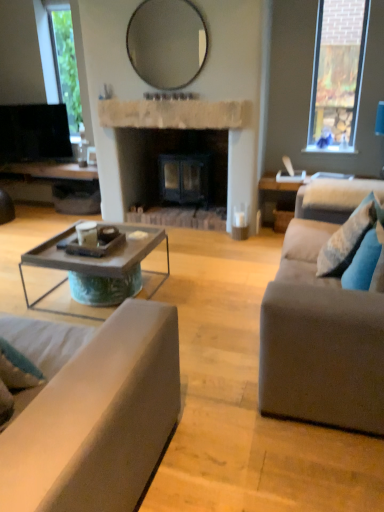
Question: Does matte glass mirror at upper center appear on the right side of blue fabric pillow at right, the 2th pillow from the back?

Choices:
 (A) no
 (B) yes

Answer: (A)

Question: Considering the relative sizes of matte glass mirror at upper center and blue fabric pillow at right, which is counted as the 1th pillow, starting from the front, in the image provided, is matte glass mirror at upper center smaller than blue fabric pillow at right, which is counted as the 1th pillow, starting from the front,?

Choices:
 (A) no
 (B) yes

Answer: (A)

Question: Is matte glass mirror at upper center wider than blue fabric pillow at right, which is counted as the 1th pillow, starting from the front?

Choices:
 (A) no
 (B) yes

Answer: (A)

Question: Does matte glass mirror at upper center have a greater height compared to blue fabric pillow at right, which is counted as the 1th pillow, starting from the front?

Choices:
 (A) yes
 (B) no

Answer: (A)

Question: Would you say matte glass mirror at upper center is outside blue fabric pillow at right, the 2th pillow from the back?

Choices:
 (A) no
 (B) yes

Answer: (B)

Question: Which is correct: matte glass mirror at upper center is inside rustic wood coffee table at center, or outside of it?

Choices:
 (A) outside
 (B) inside

Answer: (A)

Question: Looking at the image, does matte glass mirror at upper center seem bigger or smaller compared to rustic wood coffee table at center?

Choices:
 (A) big
 (B) small

Answer: (B)

Question: From the image's perspective, is matte glass mirror at upper center above or below rustic wood coffee table at center?

Choices:
 (A) above
 (B) below

Answer: (A)

Question: Looking at their shapes, would you say matte glass mirror at upper center is wider or thinner than rustic wood coffee table at center?

Choices:
 (A) thin
 (B) wide

Answer: (A)

Question: From a real-world perspective, is matte glass mirror at upper center positioned above or below blue fabric pillow at right, which is counted as the 1th pillow, starting from the front?

Choices:
 (A) below
 (B) above

Answer: (B)

Question: Based on their sizes in the image, would you say matte glass mirror at upper center is bigger or smaller than blue fabric pillow at right, which is counted as the 1th pillow, starting from the front?

Choices:
 (A) small
 (B) big

Answer: (B)

Question: Choose the correct answer: Is matte glass mirror at upper center inside blue fabric pillow at right, which is counted as the 1th pillow, starting from the front, or outside it?

Choices:
 (A) inside
 (B) outside

Answer: (B)

Question: Is point (203, 36) positioned closer to the camera than point (365, 280)?

Choices:
 (A) farther
 (B) closer

Answer: (A)

Question: Is rustic wood coffee table at center inside or outside of white stone fireplace at center?

Choices:
 (A) inside
 (B) outside

Answer: (B)

Question: From a real-world perspective, relative to white stone fireplace at center, is rustic wood coffee table at center vertically above or below?

Choices:
 (A) above
 (B) below

Answer: (B)